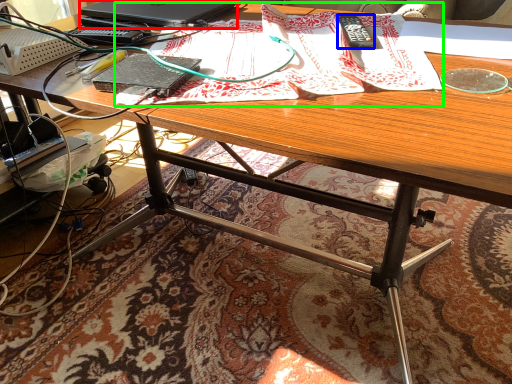
Question: Considering the real-world distances, which object is farthest from laptop (highlighted by a red box)? remote control (highlighted by a blue box) or wrapping paper (highlighted by a green box)?

Choices:
 (A) remote control
 (B) wrapping paper

Answer: (A)